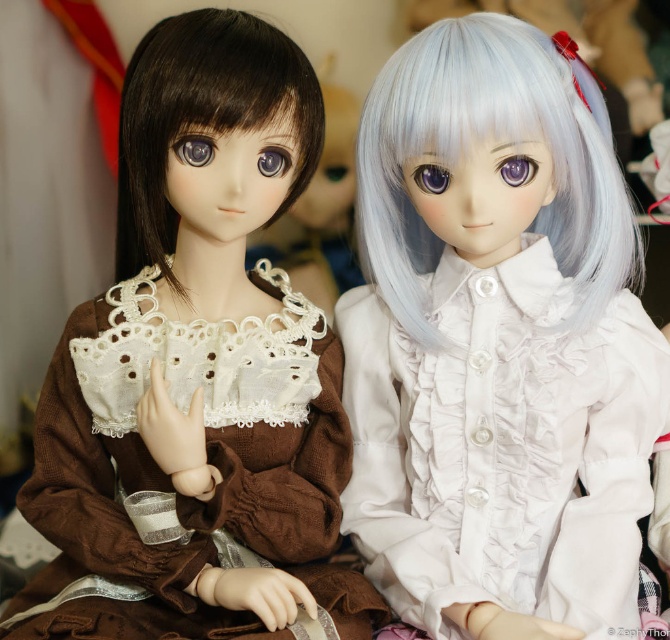
You are a photographer adjusting your camera settings to focus on two points in the image. The first point is point (60, 394) and the second is point (545, 102). Which point should you focus on first if you want to ensure the closest object is in sharp focus?

You should focus on point (60, 394) first because it is closer to the camera than point (545, 102), ensuring the closest object is in sharp focus.

You are a toy collector trying to fit both dolls into a display case that is 4 inches wide. Can the brown corduroy dress at left and the brown silky hair at left fit side by side in the case without overlapping?

The distance between the brown corduroy dress at left and the brown silky hair at left is 3.60 inches, so they can fit side by side in the 4 inch wide display case without overlapping since the required space is less than the available width.

You are a photographer adjusting your camera settings to focus on two specific points in the image. The first point is point (385, 492) and the second is point (121, 120). Since you can only focus on one point at a time, which point should you choose to ensure the doll in the foreground is sharp?

Point (385, 492) is further to the camera than point (121, 120), so you should focus on point (385, 492) to ensure the foreground doll is sharp.